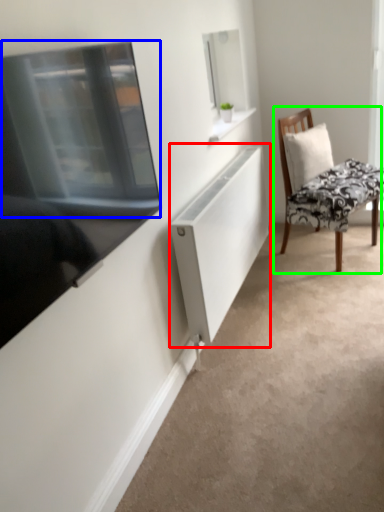
Question: Which object is the farthest from cabinet (highlighted by a red box)? Choose among these: window screen (highlighted by a blue box) or chair (highlighted by a green box).

Choices:
 (A) window screen
 (B) chair

Answer: (A)